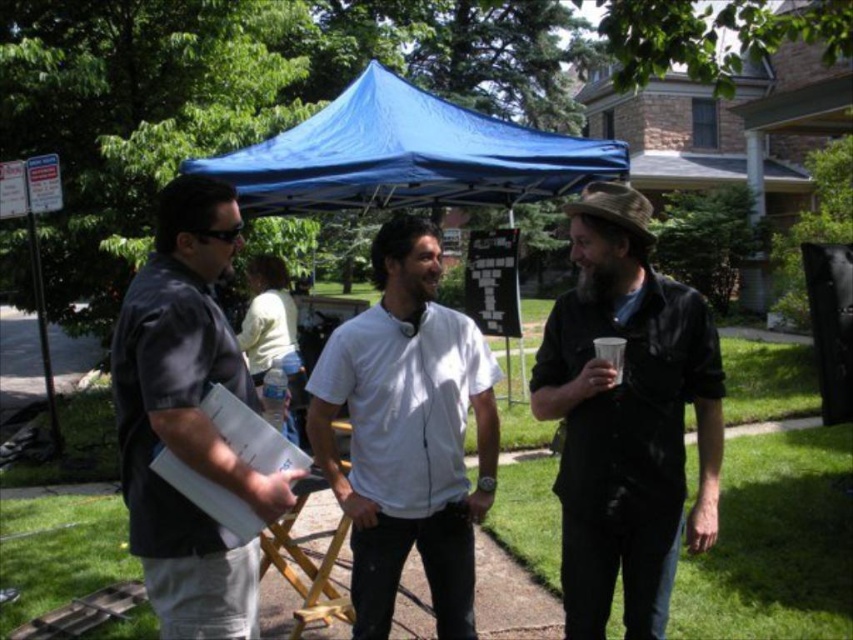
Is dark gray shirt at left wider than transparent plastic cup at right?

Yes.

Is dark gray shirt at left to the left of transparent plastic cup at right from the viewer's perspective?

Correct, you'll find dark gray shirt at left to the left of transparent plastic cup at right.

Describe the element at coordinates (187, 419) in the screenshot. I see `dark gray shirt at left` at that location.

Find the location of a particular element. dark gray shirt at left is located at coordinates tap(187, 419).

From the picture: Between dark gray shirt at left and clear plastic water bottle at center, which one is positioned higher?

dark gray shirt at left is above.

Who is lower down, dark gray shirt at left or clear plastic water bottle at center?

clear plastic water bottle at center is lower down.

Who is more forward, [210,573] or [271,410]?

Point [210,573] is in front.

This screenshot has height=640, width=853. I want to click on dark gray shirt at left, so click(187, 419).

Is the position of black matte shirt at center less distant than that of blue fabric canopy at center?

That is True.

Does black matte shirt at center have a lesser width compared to blue fabric canopy at center?

Yes.

Find the location of a particular element. black matte shirt at center is located at coordinates (625, 417).